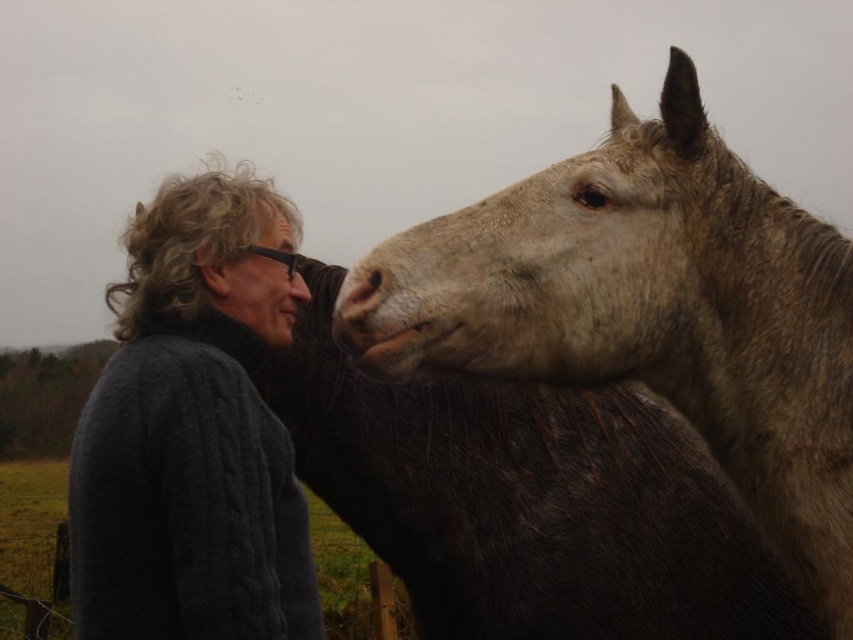
In the scene shown: Between dark gray cable-knit sweater at left and matte brown nose at center, which one is positioned lower?

dark gray cable-knit sweater at left

Where is `dark gray cable-knit sweater at left`? dark gray cable-knit sweater at left is located at coordinates (193, 429).

Identify the location of dark gray cable-knit sweater at left. This screenshot has height=640, width=853. (193, 429).

Consider the image. Is grayish-brown fur at upper right shorter than matte brown nose at center?

Incorrect, grayish-brown fur at upper right's height does not fall short of matte brown nose at center's.

Does point (714, 401) come behind point (289, 278)?

That is False.

Where is `grayish-brown fur at upper right`? grayish-brown fur at upper right is located at coordinates (648, 310).

Is grayish-brown fur at upper right further to camera compared to dark gray cable-knit sweater at left?

Yes, it is.

Image resolution: width=853 pixels, height=640 pixels. Find the location of `grayish-brown fur at upper right`. grayish-brown fur at upper right is located at coordinates (648, 310).

Who is more forward, (836,486) or (212,413)?

Positioned in front is point (836,486).

Where is `grayish-brown fur at upper right`? The width and height of the screenshot is (853, 640). grayish-brown fur at upper right is located at coordinates (648, 310).